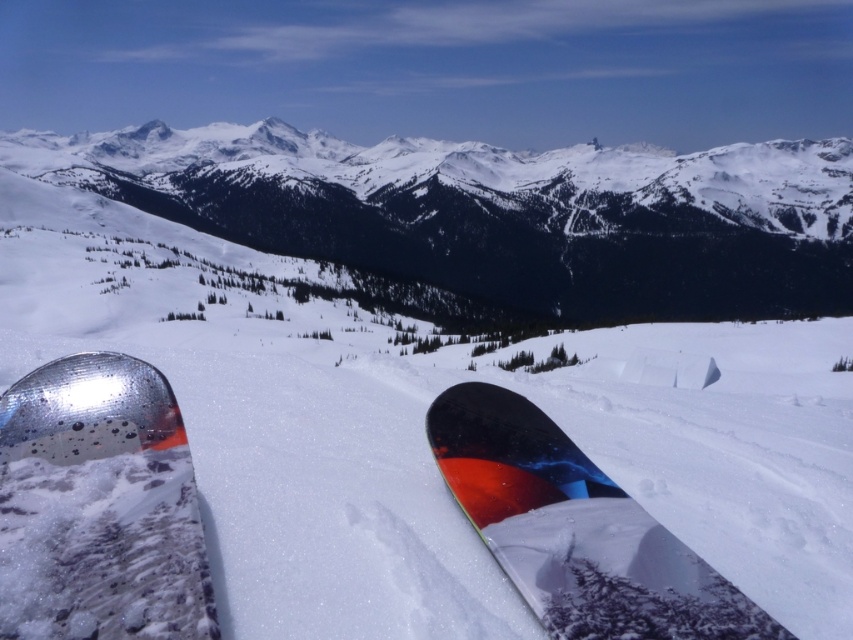
Which is in front, point (99, 353) or point (483, 401)?

Point (99, 353) is in front.

The image size is (853, 640). Identify the location of glossy metallic snowboard at lower left. (99, 508).

What do you see at coordinates (99, 508) in the screenshot? The image size is (853, 640). I see `glossy metallic snowboard at lower left` at bounding box center [99, 508].

Locate an element on the screen. glossy metallic snowboard at lower left is located at coordinates (99, 508).

Can you confirm if snowy mountain range at upper center is wider than glossy metallic snowboard at lower left?

Indeed, snowy mountain range at upper center has a greater width compared to glossy metallic snowboard at lower left.

Does snowy mountain range at upper center appear over glossy metallic snowboard at lower left?

Yes, snowy mountain range at upper center is above glossy metallic snowboard at lower left.

I want to click on snowy mountain range at upper center, so point(500,212).

Is snowy mountain range at upper center smaller than shiny black snowboard at center?

No.

Can you confirm if snowy mountain range at upper center is positioned above shiny black snowboard at center?

Yes, snowy mountain range at upper center is above shiny black snowboard at center.

Which is in front, point (438, 157) or point (469, 438)?

Point (469, 438) is in front.

The width and height of the screenshot is (853, 640). I want to click on snowy mountain range at upper center, so click(x=500, y=212).